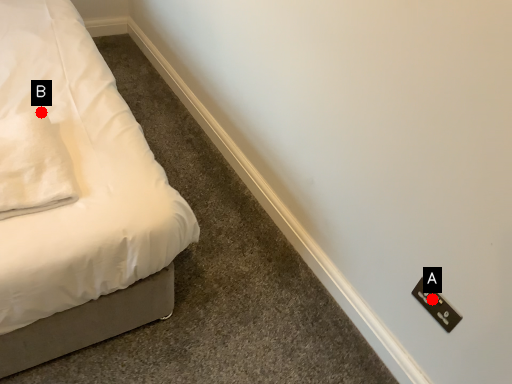
Question: Two points are circled on the image, labeled by A and B beside each circle. Which of the following is the closest to the observer?

Choices:
 (A) A is closer
 (B) B is closer

Answer: (A)